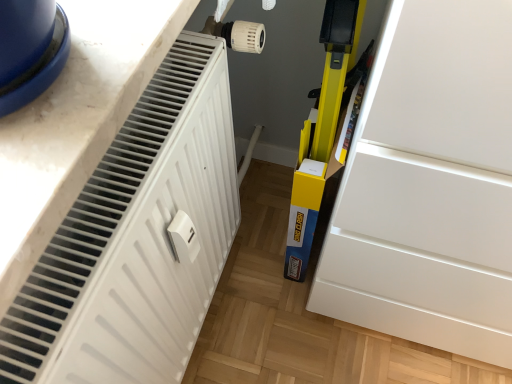
The width and height of the screenshot is (512, 384). Describe the element at coordinates (77, 117) in the screenshot. I see `white matte countertop at upper left` at that location.

Locate an element on the screen. Image resolution: width=512 pixels, height=384 pixels. white matte countertop at upper left is located at coordinates (77, 117).

In order to face white matte countertop at upper left, should I rotate leftwards or rightwards?

Turn left approximately 9.089 degrees to face it.

This screenshot has height=384, width=512. I want to click on white matte countertop at upper left, so click(x=77, y=117).